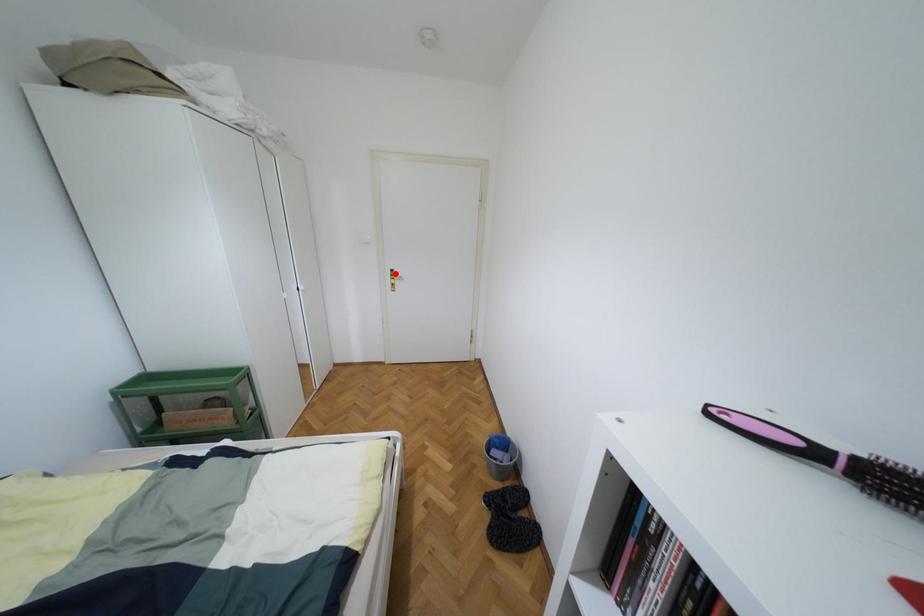
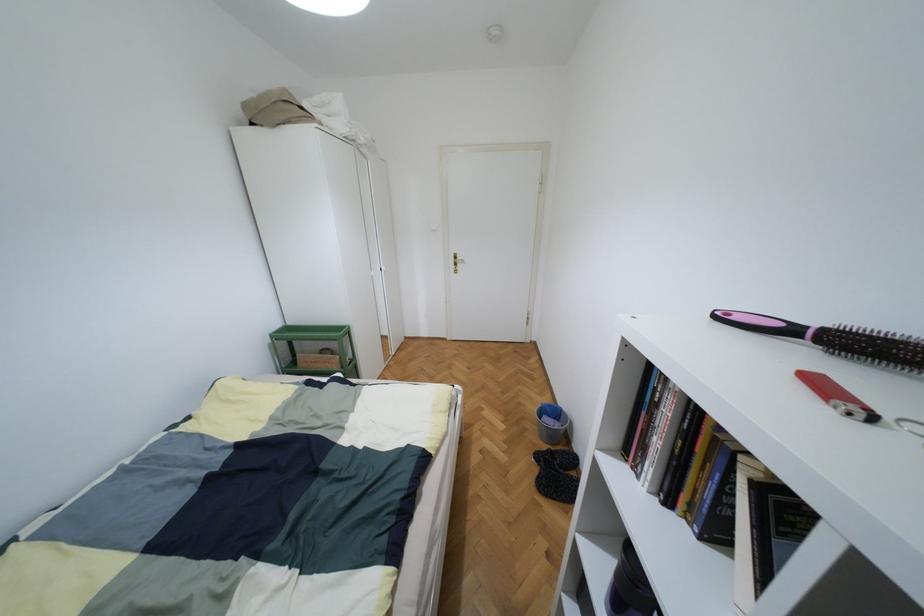
Question: I am providing you with two images of the same scene from different viewpoints. A red point is shown in image1. For the corresponding object point in image2, is it positioned nearer or farther from the camera?

Choices:
 (A) Nearer
 (B) Farther

Answer: (A)